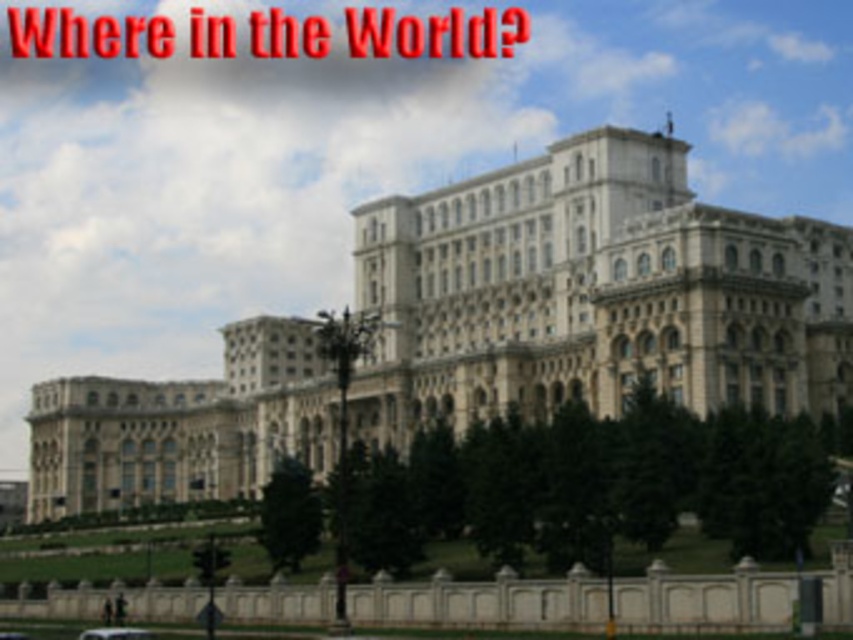
You are a delivery driver who needs to park your white matte car at lower left as close as possible to the beige stone building at center without blocking the entrance. The parking area is 200 feet long. Can you safely park your car within the parking area while maintaining the required distance of at least 50 feet from the entrance?

The distance between the beige stone building at center and the white matte car at lower left is 188.08 feet. Since the parking area is 200 feet long and the required minimum distance from the entrance is 50 feet, you can park the white matte car at lower left within the parking area while maintaining the required distance.

You are standing at the point closest to the building. Which point, point (x=576, y=272) or point (x=119, y=637), is behind the other?

Point (x=576, y=272) is behind point (x=119, y=637).